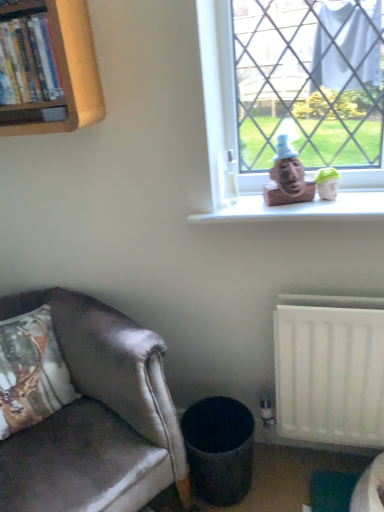
Question: Can you confirm if satin brown leather chair at lower left is positioned to the left of matte brown bust at window?

Choices:
 (A) yes
 (B) no

Answer: (A)

Question: From the image's perspective, would you say satin brown leather chair at lower left is positioned over matte brown bust at window?

Choices:
 (A) no
 (B) yes

Answer: (A)

Question: Considering the relative sizes of satin brown leather chair at lower left and matte brown bust at window in the image provided, is satin brown leather chair at lower left thinner than matte brown bust at window?

Choices:
 (A) no
 (B) yes

Answer: (A)

Question: From a real-world perspective, is satin brown leather chair at lower left physically above matte brown bust at window?

Choices:
 (A) no
 (B) yes

Answer: (A)

Question: Is matte brown bust at window at the back of satin brown leather chair at lower left?

Choices:
 (A) yes
 (B) no

Answer: (B)

Question: Would you say satin brown leather chair at lower left is outside matte brown bust at window?

Choices:
 (A) no
 (B) yes

Answer: (B)

Question: Does wooden bookshelf at upper left lie behind satin brown leather chair at lower left?

Choices:
 (A) no
 (B) yes

Answer: (B)

Question: Is wooden bookshelf at upper left turned away from satin brown leather chair at lower left?

Choices:
 (A) no
 (B) yes

Answer: (A)

Question: Can you confirm if wooden bookshelf at upper left is thinner than satin brown leather chair at lower left?

Choices:
 (A) no
 (B) yes

Answer: (B)

Question: Is wooden bookshelf at upper left oriented towards satin brown leather chair at lower left?

Choices:
 (A) yes
 (B) no

Answer: (B)

Question: From the image's perspective, is wooden bookshelf at upper left above satin brown leather chair at lower left?

Choices:
 (A) yes
 (B) no

Answer: (A)

Question: Can satin brown leather chair at lower left be found inside wooden bookshelf at upper left?

Choices:
 (A) no
 (B) yes

Answer: (A)

Question: Is satin brown leather chair at lower left behind textured gray trash can at lower center?

Choices:
 (A) no
 (B) yes

Answer: (A)